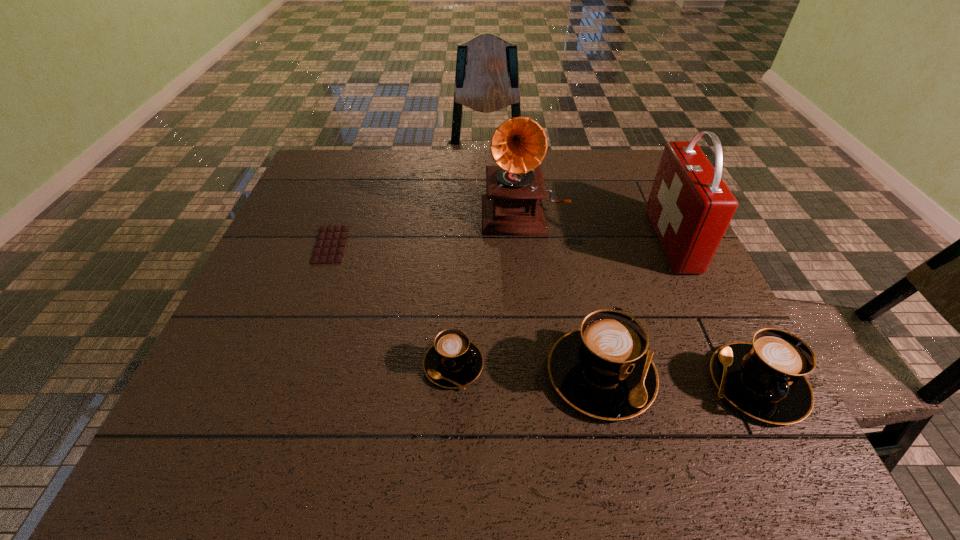
Identify the location of free spot between the first-aid kit and the second cappuccino from left to right. (637, 308).

At what (x,y) coordinates should I click in order to perform the action: click on free space between the second tallest cappuccino and the shortest object. Please return your answer as a coordinate pair (x, y). Image resolution: width=960 pixels, height=540 pixels. Looking at the image, I should click on (543, 314).

Locate an element on the screen. This screenshot has width=960, height=540. unoccupied area between the leftmost object and the second tallest cappuccino is located at coordinates (543, 314).

In order to click on unoccupied position between the second cappuccino from right to left and the first-aid kit in this screenshot , I will do `click(637, 308)`.

You are a GUI agent. You are given a task and a screenshot of the screen. Output one action in this format:
    pyautogui.click(x=<x>, y=<y>)
    Task: Click on the empty space that is in between the second cappuccino from right to left and the second shortest cappuccino
    
    Given the screenshot: What is the action you would take?
    pyautogui.click(x=679, y=379)

At what (x,y) coordinates should I click in order to perform the action: click on vacant region between the second cappuccino from left to right and the fourth tallest object. Please return your answer as a coordinate pair (x, y). This screenshot has width=960, height=540. Looking at the image, I should click on (679, 379).

Identify which object is the second closest to the second tallest cappuccino. Please provide its 2D coordinates. Your answer should be formatted as a tuple, i.e. [(x, y)], where the tuple contains the x and y coordinates of a point satisfying the conditions above.

[(690, 207)]

Identify which object is located as the fourth nearest to the phonograph record. Please provide its 2D coordinates. Your answer should be formatted as a tuple, i.e. [(x, y)], where the tuple contains the x and y coordinates of a point satisfying the conditions above.

[(329, 248)]

Locate an element on the screen. cappuccino that stands as the closest to the second shortest object is located at coordinates (602, 369).

Select which cappuccino appears as the second closest to the second cappuccino from right to left. Please provide its 2D coordinates. Your answer should be formatted as a tuple, i.e. [(x, y)], where the tuple contains the x and y coordinates of a point satisfying the conditions above.

[(453, 361)]